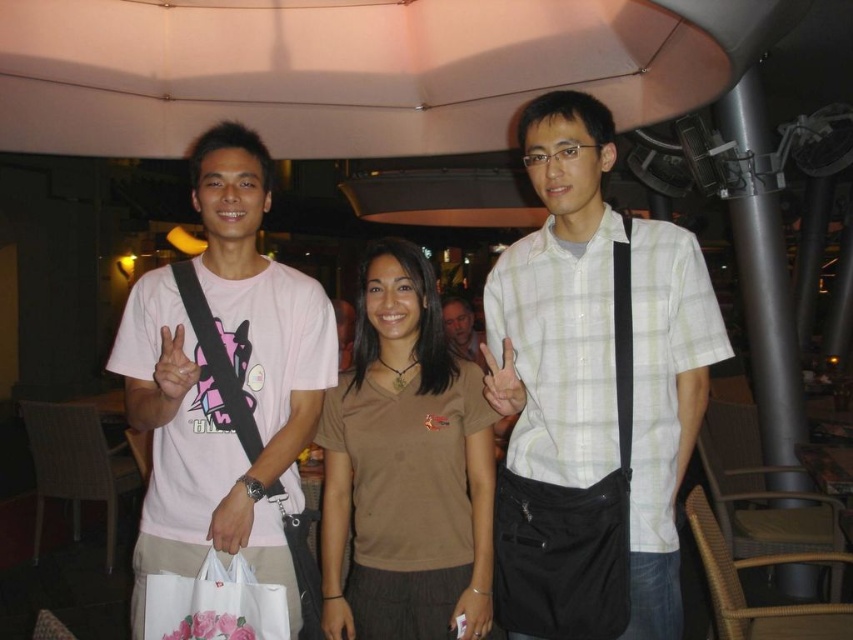
Between white checkered shirt at center and brown cotton shirt at center, which one has more height?

white checkered shirt at center is taller.

Is white checkered shirt at center positioned at the back of brown cotton shirt at center?

No, white checkered shirt at center is in front of brown cotton shirt at center.

Locate an element on the screen. This screenshot has height=640, width=853. white checkered shirt at center is located at coordinates (592, 392).

Is matte pink t-shirt at left to the right of brown cotton shirt at center from the viewer's perspective?

Incorrect, matte pink t-shirt at left is not on the right side of brown cotton shirt at center.

Can you confirm if matte pink t-shirt at left is positioned to the left of brown cotton shirt at center?

Indeed, matte pink t-shirt at left is positioned on the left side of brown cotton shirt at center.

Is point (198, 380) less distant than point (467, 602)?

Yes, point (198, 380) is closer to viewer.

Where is `matte pink t-shirt at left`? matte pink t-shirt at left is located at coordinates [x=225, y=385].

Does white checkered shirt at center have a lesser height compared to white plastic bag at lower center?

In fact, white checkered shirt at center may be taller than white plastic bag at lower center.

How distant is white checkered shirt at center from white plastic bag at lower center?

white checkered shirt at center is 30.40 inches away from white plastic bag at lower center.

Identify the location of white checkered shirt at center. (592, 392).

You are a GUI agent. You are given a task and a screenshot of the screen. Output one action in this format:
    pyautogui.click(x=<x>, y=<y>)
    Task: Click on the white checkered shirt at center
    
    Given the screenshot: What is the action you would take?
    pyautogui.click(x=592, y=392)